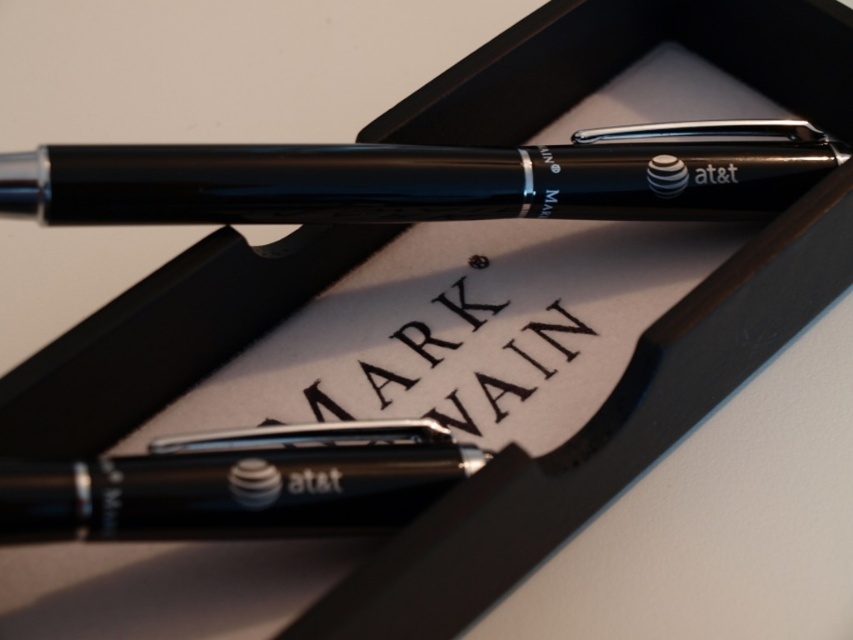
Is matte black pen at upper center below black metallic pen at center?

Actually, matte black pen at upper center is above black metallic pen at center.

This screenshot has width=853, height=640. Identify the location of matte black pen at upper center. (427, 179).

Find the location of a particular element. This screenshot has height=640, width=853. matte black pen at upper center is located at coordinates tap(427, 179).